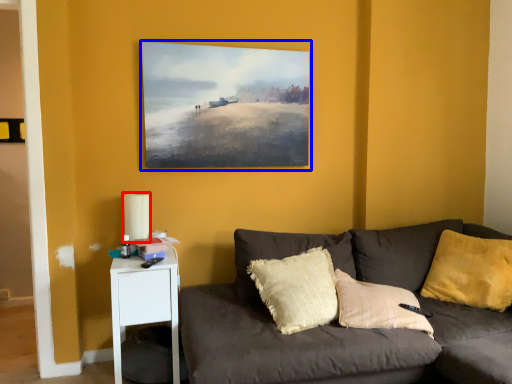
Question: Which object is further to the camera taking this photo, lamp (highlighted by a red box) or picture frame (highlighted by a blue box)?

Choices:
 (A) lamp
 (B) picture frame

Answer: (B)